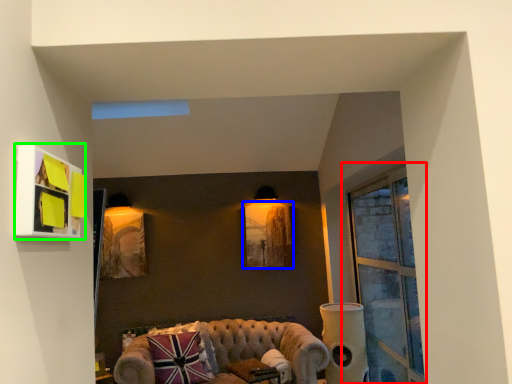
Question: Estimate the real-world distances between objects in this image. Which object is farther from window (highlighted by a red box), picture frame (highlighted by a blue box) or picture frame (highlighted by a green box)?

Choices:
 (A) picture frame
 (B) picture frame

Answer: (B)